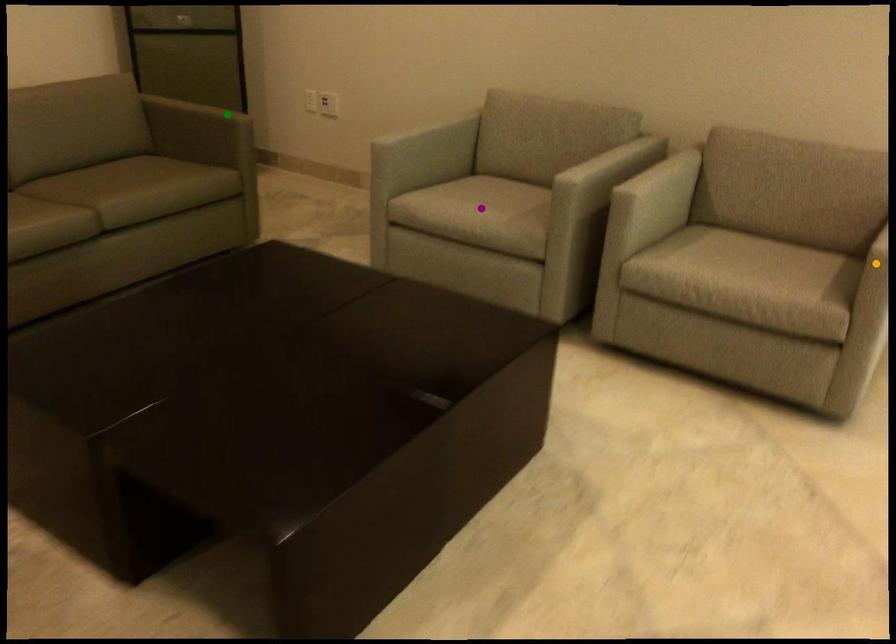
Order these from nearest to farthest:
- green point
- orange point
- purple point

orange point < purple point < green point